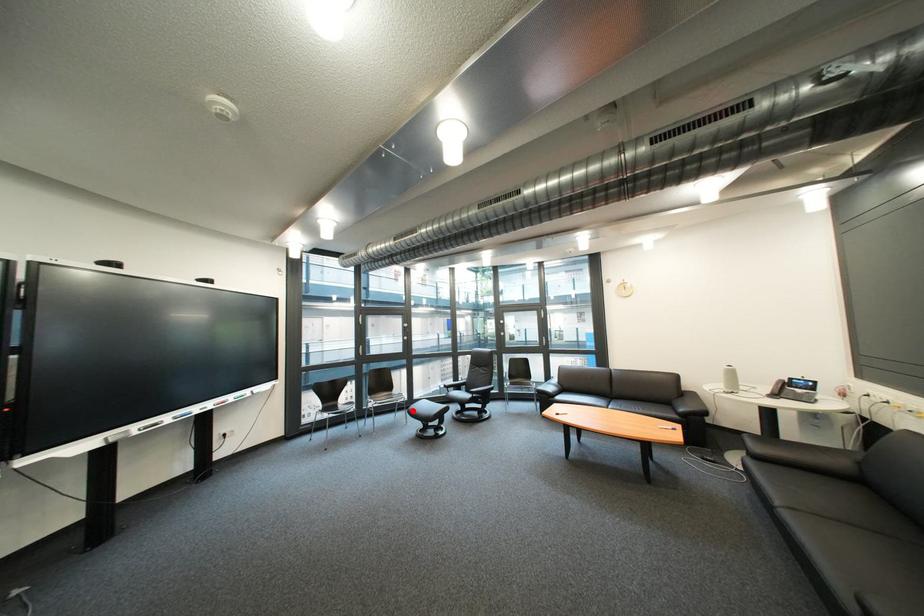
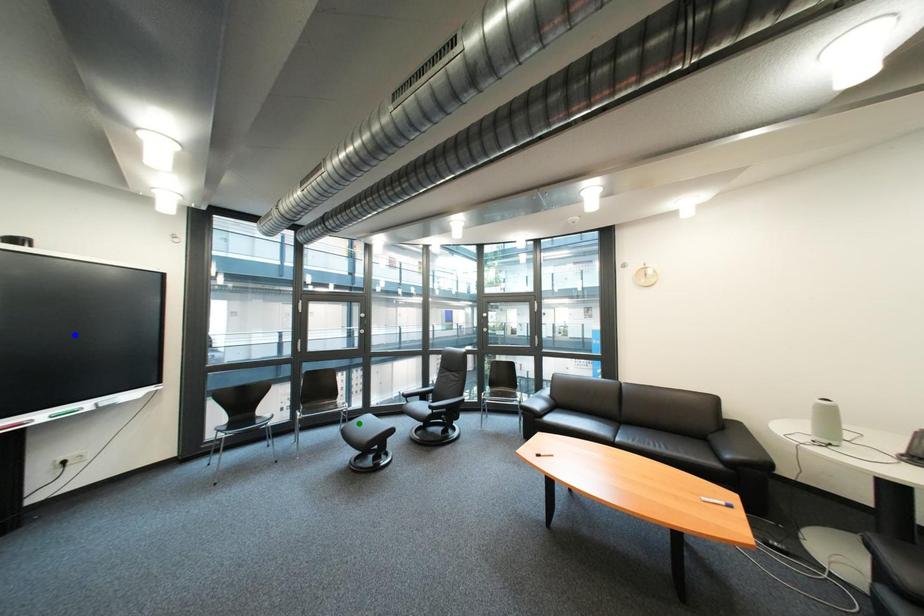
Question: I am providing you with two images of the same scene from different viewpoints. A red point is marked on the first image. You are given multiple points on the second image. In image 2, which mark is for the same physical point as the one in image 1?

Choices:
 (A) green point
 (B) yellow point
 (C) blue point

Answer: (A)